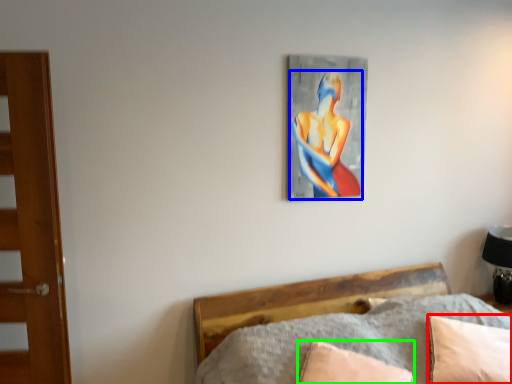
Question: Which object is positioned farthest from pillow (highlighted by a red box)? Select from person (highlighted by a blue box) and pillow (highlighted by a green box).

Choices:
 (A) person
 (B) pillow

Answer: (A)